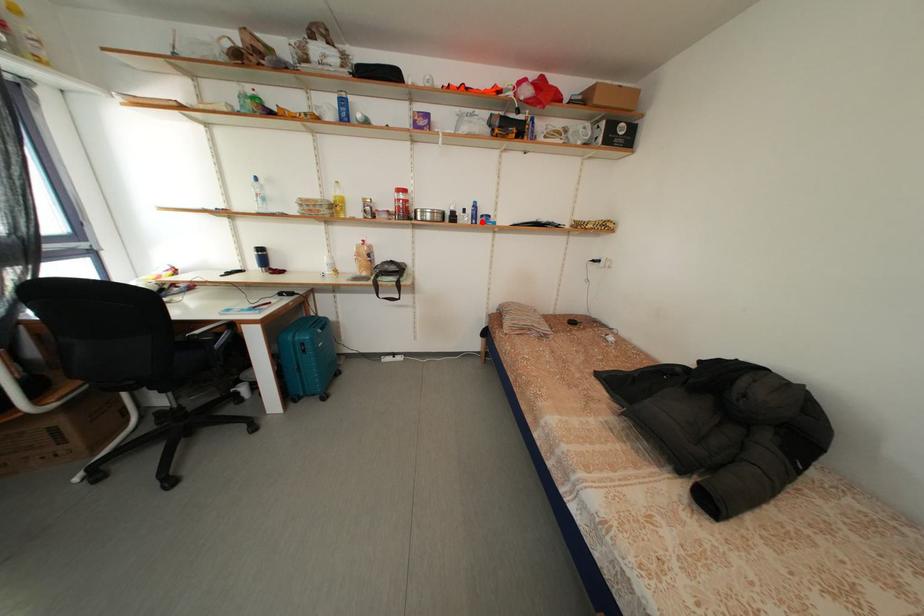
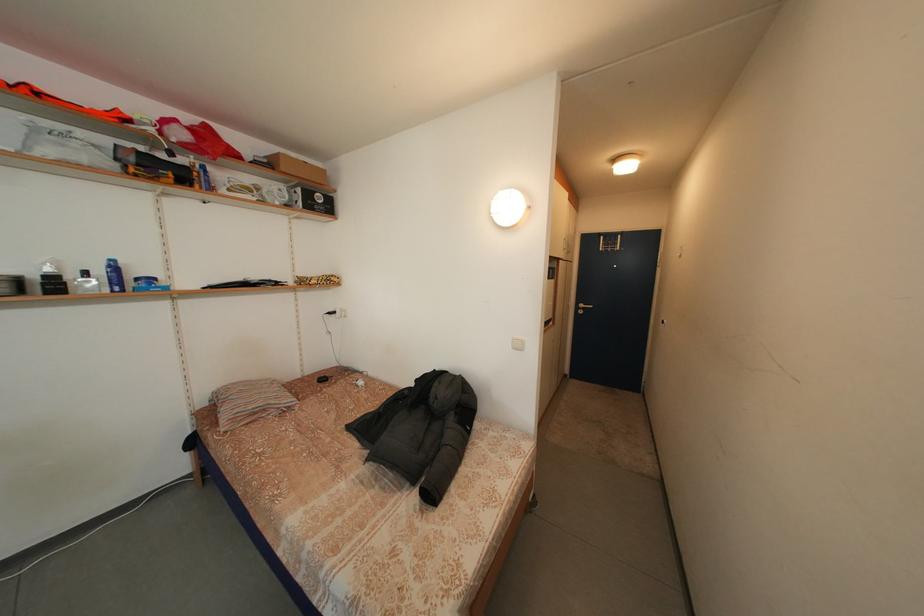
Where in the second image is the point corresponding to the highlighted location from the first image?

(125, 286)